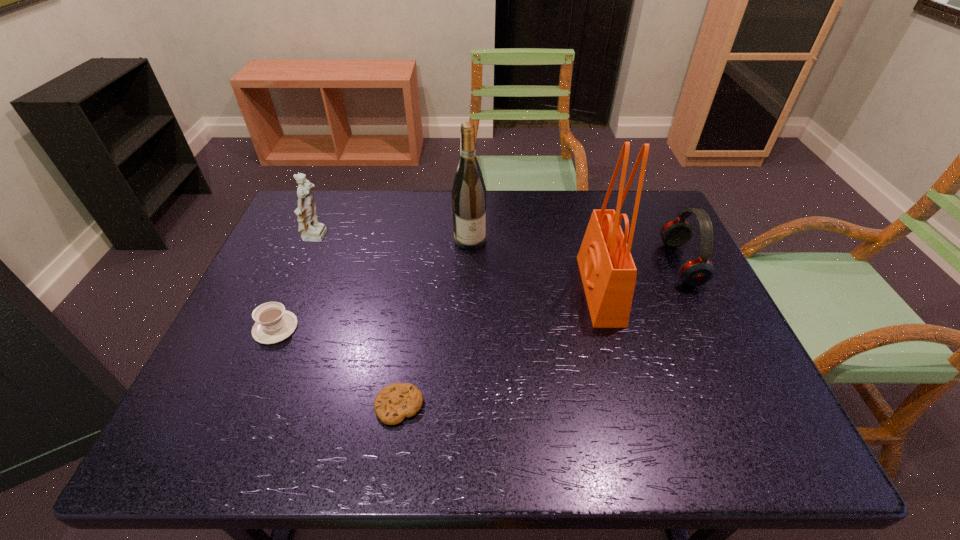
Identify the location of figurine that is at the far edge. Image resolution: width=960 pixels, height=540 pixels. (311, 230).

Locate an element on the screen. object that is at the near edge is located at coordinates (393, 403).

Where is `figurine that is positioned at the left edge`? figurine that is positioned at the left edge is located at coordinates (311, 230).

The image size is (960, 540). Find the location of `teacup located in the left edge section of the desktop`. teacup located in the left edge section of the desktop is located at coordinates (274, 324).

Where is `object that is positioned at the right edge`? object that is positioned at the right edge is located at coordinates (698, 271).

At what (x,y) coordinates should I click in order to perform the action: click on object at the far left corner. Please return your answer as a coordinate pair (x, y). Looking at the image, I should click on (311, 230).

The height and width of the screenshot is (540, 960). I want to click on free region at the far edge of the desktop, so click(x=568, y=202).

Where is `free spot at the near edge of the desktop`? This screenshot has width=960, height=540. free spot at the near edge of the desktop is located at coordinates tap(554, 423).

In the image, there is a desktop. Identify the location of free region at the left edge. (195, 394).

In the image, there is a desktop. Where is `vacant space at the right edge`? The image size is (960, 540). vacant space at the right edge is located at coordinates (713, 397).